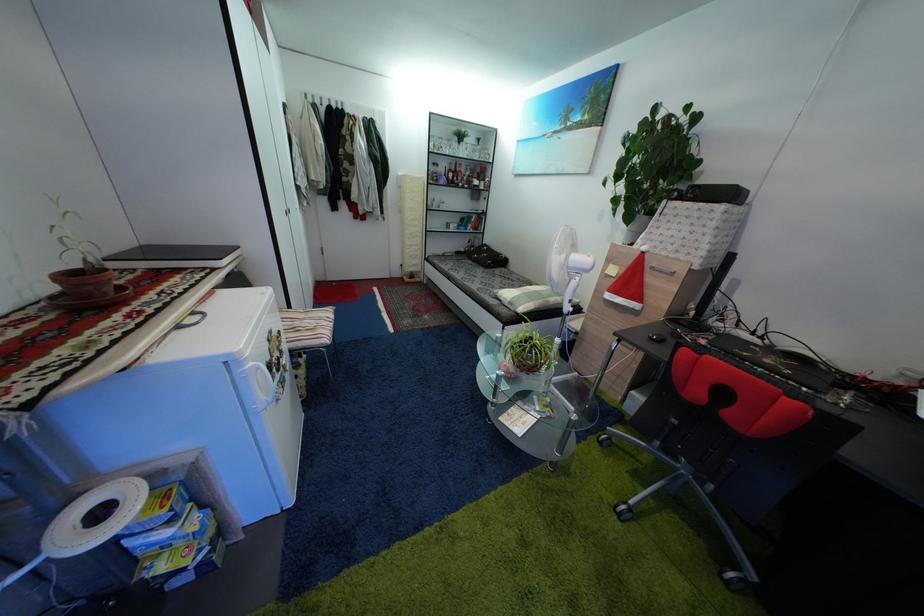
Where is `small plant pot`? The width and height of the screenshot is (924, 616). small plant pot is located at coordinates (526, 366).